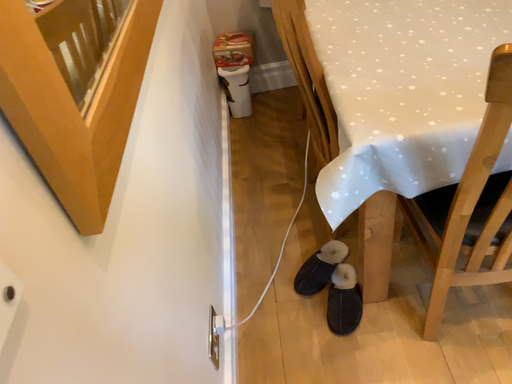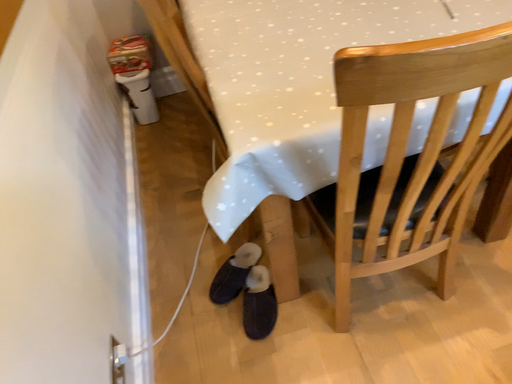
Question: Which way did the camera rotate in the video?

Choices:
 (A) rotated right
 (B) rotated left

Answer: (A)